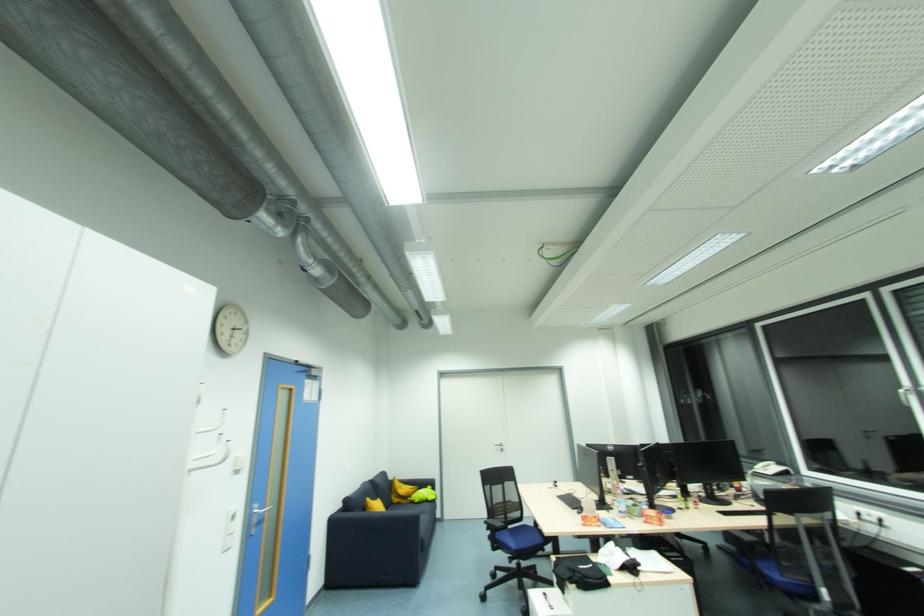
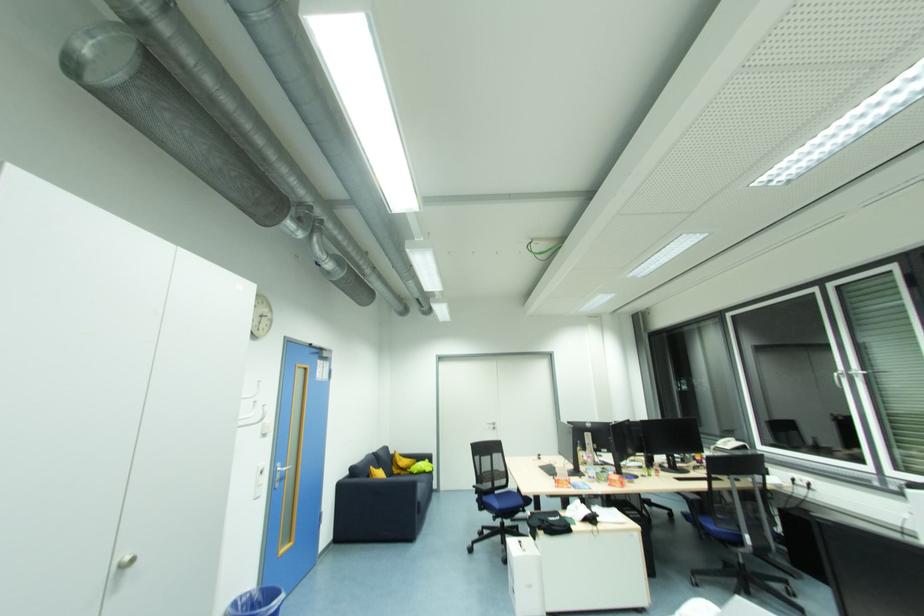
Locate, in the second image, the point that corresponds to pixel 513 529 in the first image.

(500, 493)